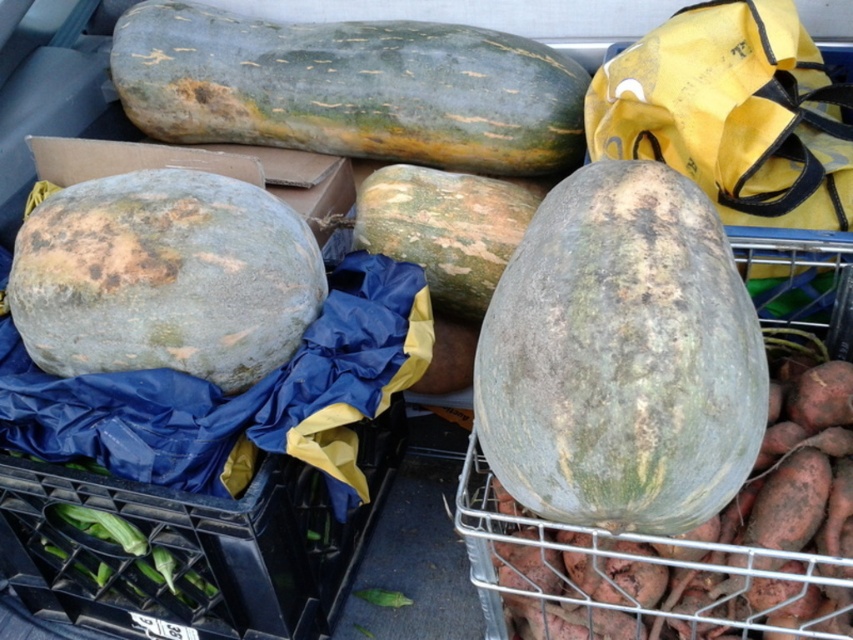
Question: Is greenish-gray textured squash at upper center above green matte sweet potato at center?

Choices:
 (A) yes
 (B) no

Answer: (A)

Question: Which object is closer to the camera taking this photo?

Choices:
 (A) green rough squash at left
 (B) speckled green cantaloupe at center

Answer: (B)

Question: Is speckled green cantaloupe at center closer to the viewer compared to greenish-gray textured squash at upper center?

Choices:
 (A) no
 (B) yes

Answer: (B)

Question: Which point appears closest to the camera in this image?

Choices:
 (A) (734, 516)
 (B) (242, 234)
 (C) (160, 29)
 (D) (517, 476)

Answer: (D)

Question: Considering the real-world distances, which object is closest to the speckled green cantaloupe at center?

Choices:
 (A) green matte sweet potato at center
 (B) greenish-gray textured squash at upper center

Answer: (A)

Question: Is speckled green cantaloupe at center to the right of green rough squash at left from the viewer's perspective?

Choices:
 (A) no
 (B) yes

Answer: (B)